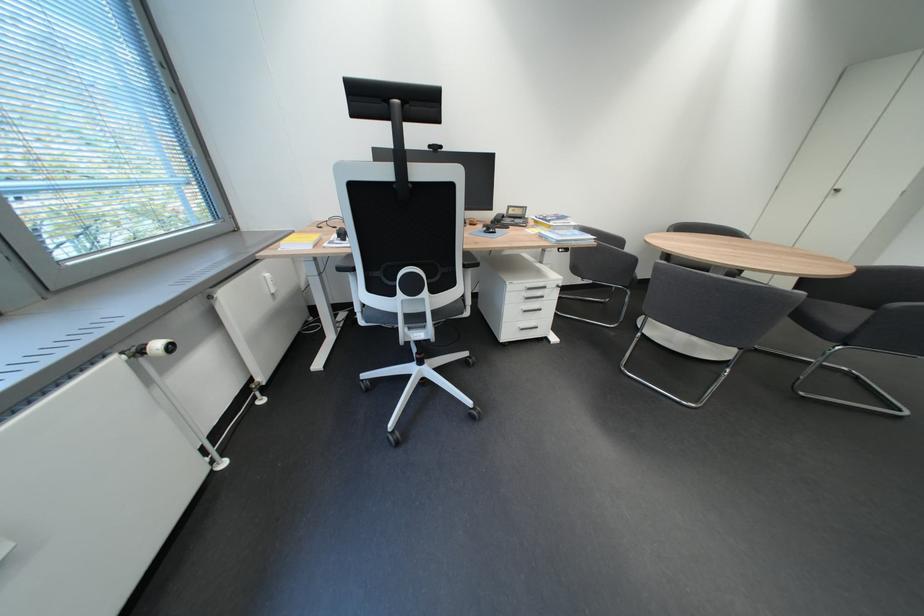
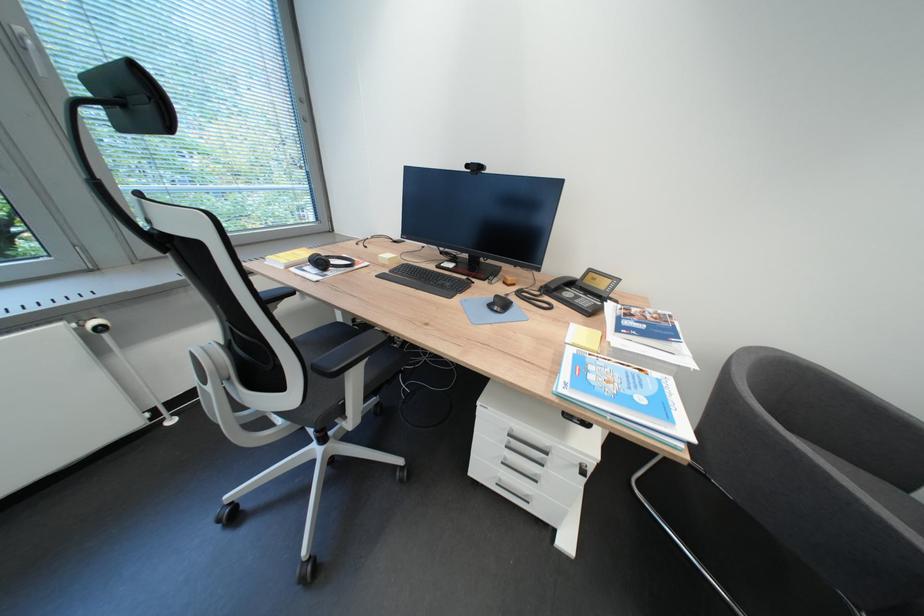
Locate, in the second image, the point that corresponds to (168,346) in the first image.

(106, 325)